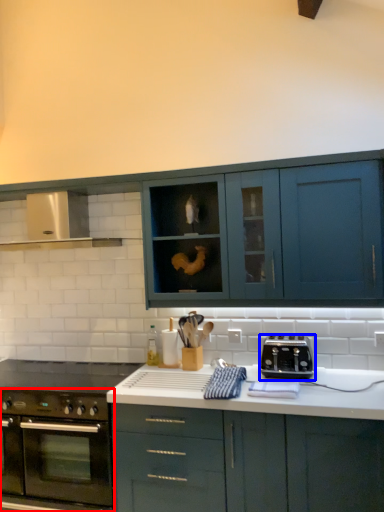
Question: Which object appears closest to the camera in this image, oven (highlighted by a red box) or toaster (highlighted by a blue box)?

Choices:
 (A) oven
 (B) toaster

Answer: (A)